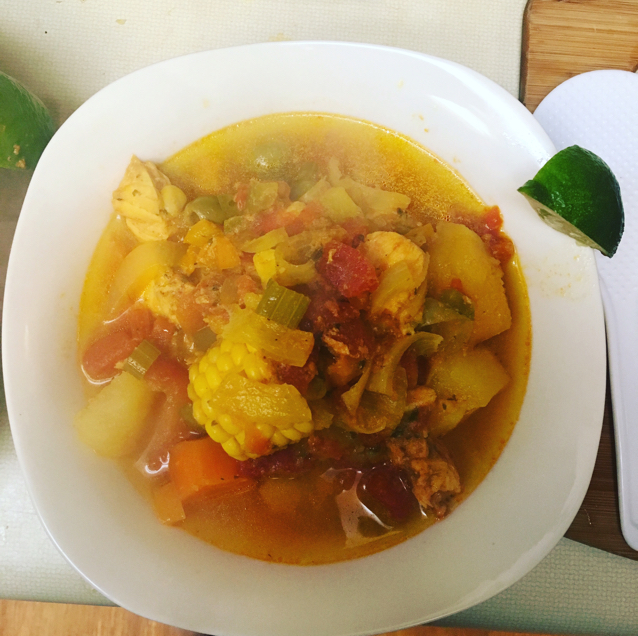
Find the location of a particular element. This screenshot has height=636, width=638. bowl is located at coordinates (507, 547).